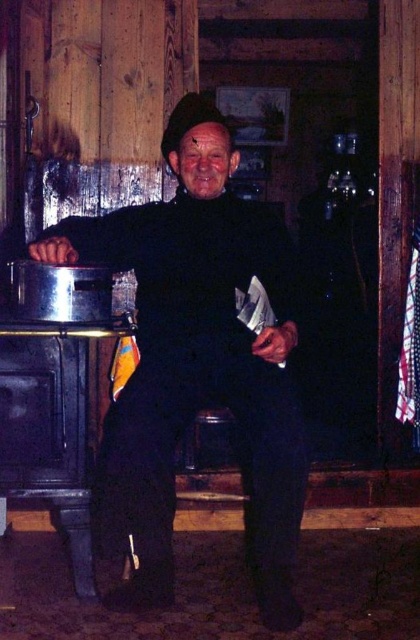
Is point (31, 328) closer to camera compared to point (109, 328)?

That is True.

Locate an element on the screen. This screenshot has width=420, height=640. black matte oven at left is located at coordinates (49, 428).

Can you confirm if black matte jacket at center is taller than black matte oven at left?

Correct, black matte jacket at center is much taller as black matte oven at left.

In order to click on black matte jacket at center in this screenshot , I will do `click(197, 362)`.

The width and height of the screenshot is (420, 640). I want to click on black matte jacket at center, so pyautogui.click(x=197, y=362).

Who is more distant from viewer, (36, 445) or (46, 310)?

The point (36, 445) is more distant.

In the scene shown: Can you confirm if black matte oven at left is positioned to the left of metallic silver pot at left?

Incorrect, black matte oven at left is not on the left side of metallic silver pot at left.

At what (x,y) coordinates should I click in order to perform the action: click on black matte oven at left. Please return your answer as a coordinate pair (x, y). The width and height of the screenshot is (420, 640). Looking at the image, I should click on (49, 428).

This screenshot has height=640, width=420. Identify the location of black matte oven at left. (49, 428).